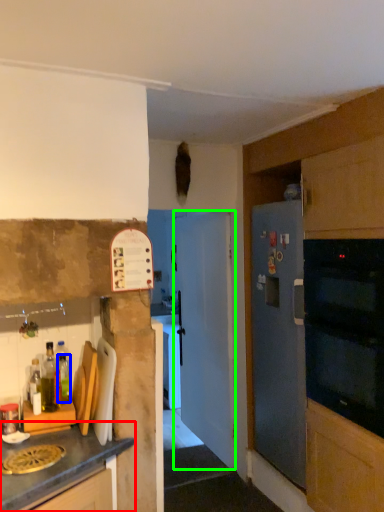
Question: Which object is positioned closest to cabinetry (highlighted by a red box)? Select from bottle (highlighted by a blue box) and door (highlighted by a green box).

Choices:
 (A) bottle
 (B) door

Answer: (A)